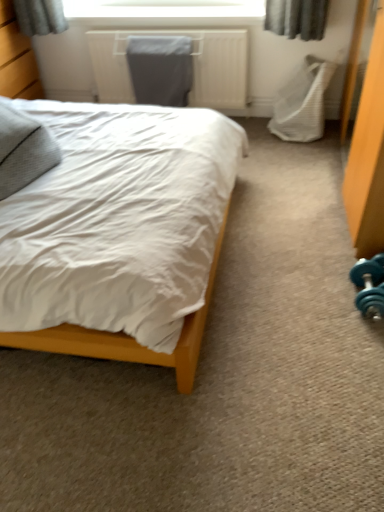
The image size is (384, 512). What do you see at coordinates (23, 150) in the screenshot?
I see `gray fabric pillow at left` at bounding box center [23, 150].

In order to face gray fabric pillow at left, should I rotate leftwards or rightwards?

Rotate your view left by about 24.482°.

Where is `teal rubber dumbbell at lower right`? The image size is (384, 512). teal rubber dumbbell at lower right is located at coordinates (369, 286).

The image size is (384, 512). What are the coordinates of `wooden dresser at left` in the screenshot? It's located at (16, 58).

Identify the location of gray fabric pillow at left. (23, 150).

Considering the sizes of objects teal rubber dumbbell at lower right and wooden dresser at left in the image provided, who is wider, teal rubber dumbbell at lower right or wooden dresser at left?

With larger width is wooden dresser at left.

Does teal rubber dumbbell at lower right have a lesser height compared to wooden dresser at left?

Yes, teal rubber dumbbell at lower right is shorter than wooden dresser at left.

How distant is teal rubber dumbbell at lower right from wooden dresser at left?

The distance of teal rubber dumbbell at lower right from wooden dresser at left is 2.68 meters.

From the image's perspective, which one is positioned lower, teal rubber dumbbell at lower right or wooden dresser at left?

teal rubber dumbbell at lower right.

What's the angular difference between white matte bed at center and gray fabric pillow at left's facing directions?

white matte bed at center and gray fabric pillow at left are facing 20.9 degrees away from each other.

Which of these two, white matte bed at center or gray fabric pillow at left, is bigger?

With larger size is white matte bed at center.

The width and height of the screenshot is (384, 512). What are the coordinates of `pillow above the white matte bed at center (from the image's perspective)` in the screenshot? It's located at point(23,150).

Which point is more forward, (132,209) or (1,128)?

The point (132,209) is closer.

How far apart are wooden dresser at left and white fabric swivel chair at right?

1.95 meters.

From the image's perspective, is wooden dresser at left on top of white fabric swivel chair at right?

Yes, from the image's perspective, wooden dresser at left is above white fabric swivel chair at right.

Would you consider wooden dresser at left to be distant from white fabric swivel chair at right?

Indeed, wooden dresser at left is not near white fabric swivel chair at right.

From a real-world perspective, is white fabric swivel chair at right physically located above or below white matte bed at center?

white fabric swivel chair at right is below white matte bed at center.

From the image's perspective, is white fabric swivel chair at right located above or below white matte bed at center?

white fabric swivel chair at right is above white matte bed at center.

Does gray fabric pillow at left contain teal rubber dumbbell at lower right?

Definitely not — teal rubber dumbbell at lower right is not inside gray fabric pillow at left.

In the image, there is a gray fabric pillow at left. Identify the location of dumbbell below it (from the image's perspective). (369, 286).

In the scene shown: Can you confirm if gray fabric pillow at left is shorter than teal rubber dumbbell at lower right?

In fact, gray fabric pillow at left may be taller than teal rubber dumbbell at lower right.

What's the angular difference between white fabric swivel chair at right and wooden dresser at left's facing directions?

85.6 degrees.

Looking at this image, is white fabric swivel chair at right to the left or to the right of wooden dresser at left in the image?

From the image, it's evident that white fabric swivel chair at right is to the right of wooden dresser at left.

Is white fabric swivel chair at right spatially inside wooden dresser at left, or outside of it?

The correct answer is: outside.

Does white fabric swivel chair at right have a lesser height compared to wooden dresser at left?

Yes.

Is gray fabric pillow at left facing towards white fabric swivel chair at right?

No, gray fabric pillow at left is not aimed at white fabric swivel chair at right.

Based on their sizes in the image, would you say gray fabric pillow at left is bigger or smaller than white fabric swivel chair at right?

Considering their sizes, gray fabric pillow at left takes up less space than white fabric swivel chair at right.

Which of these two, gray fabric pillow at left or white fabric swivel chair at right, is thinner?

white fabric swivel chair at right.

Relative to white fabric swivel chair at right, is gray fabric pillow at left in front or behind?

gray fabric pillow at left is in front of white fabric swivel chair at right.

This screenshot has width=384, height=512. In the image, there is a wooden dresser at left. What are the coordinates of `dumbbell below it (from the image's perspective)` in the screenshot? It's located at (369, 286).

At what (x,y) coordinates should I click in order to perform the action: click on pillow above the white matte bed at center (from a real-world perspective). Please return your answer as a coordinate pair (x, y). Image resolution: width=384 pixels, height=512 pixels. Looking at the image, I should click on (23, 150).

Considering their positions, is white fabric swivel chair at right positioned further to white matte bed at center than gray fabric pillow at left?

Among the two, white fabric swivel chair at right is located further to white matte bed at center.

Estimate the real-world distances between objects in this image. Which object is further from teal rubber dumbbell at lower right, white fabric swivel chair at right or wooden dresser at left?

Among the two, wooden dresser at left is located further to teal rubber dumbbell at lower right.

Based on their spatial positions, is teal rubber dumbbell at lower right or gray fabric pillow at left closer to wooden dresser at left?

gray fabric pillow at left.

Looking at the image, which one is located closer to teal rubber dumbbell at lower right, white matte bed at center or gray fabric pillow at left?

Among the two, white matte bed at center is located nearer to teal rubber dumbbell at lower right.

When comparing their distances from gray fabric pillow at left, does wooden dresser at left or white fabric swivel chair at right seem closer?

wooden dresser at left is positioned closer to the anchor gray fabric pillow at left.

From the image, which object appears to be farther from white fabric swivel chair at right, gray fabric pillow at left or wooden dresser at left?

wooden dresser at left is further to white fabric swivel chair at right.

Estimate the real-world distances between objects in this image. Which object is closer to wooden dresser at left, white matte bed at center or teal rubber dumbbell at lower right?

white matte bed at center.

Considering their positions, is wooden dresser at left positioned further to white fabric swivel chair at right than teal rubber dumbbell at lower right?

Among the two, wooden dresser at left is located further to white fabric swivel chair at right.

You are a GUI agent. You are given a task and a screenshot of the screen. Output one action in this format:
    pyautogui.click(x=<x>, y=<y>)
    Task: Click on the bed situated between gray fabric pillow at left and white fabric swivel chair at right from left to right
    This screenshot has height=512, width=384.
    Given the screenshot: What is the action you would take?
    pyautogui.click(x=119, y=233)

At what (x,y) coordinates should I click in order to perform the action: click on bed situated between gray fabric pillow at left and teal rubber dumbbell at lower right from left to right. Please return your answer as a coordinate pair (x, y). Image resolution: width=384 pixels, height=512 pixels. Looking at the image, I should click on (119, 233).

You are a GUI agent. You are given a task and a screenshot of the screen. Output one action in this format:
    pyautogui.click(x=<x>, y=<y>)
    Task: Click on the pillow located between wooden dresser at left and teal rubber dumbbell at lower right in the left-right direction
    This screenshot has height=512, width=384.
    Given the screenshot: What is the action you would take?
    pyautogui.click(x=23, y=150)

The width and height of the screenshot is (384, 512). In order to click on pillow between wooden dresser at left and white fabric swivel chair at right in the horizontal direction in this screenshot , I will do `click(23, 150)`.